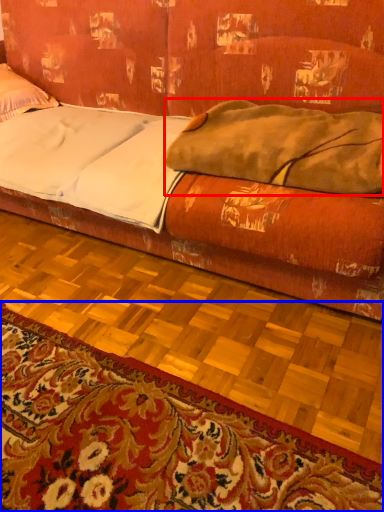
Question: Among these objects, which one is nearest to the camera, blanket (highlighted by a red box) or mat (highlighted by a blue box)?

Choices:
 (A) blanket
 (B) mat

Answer: (B)